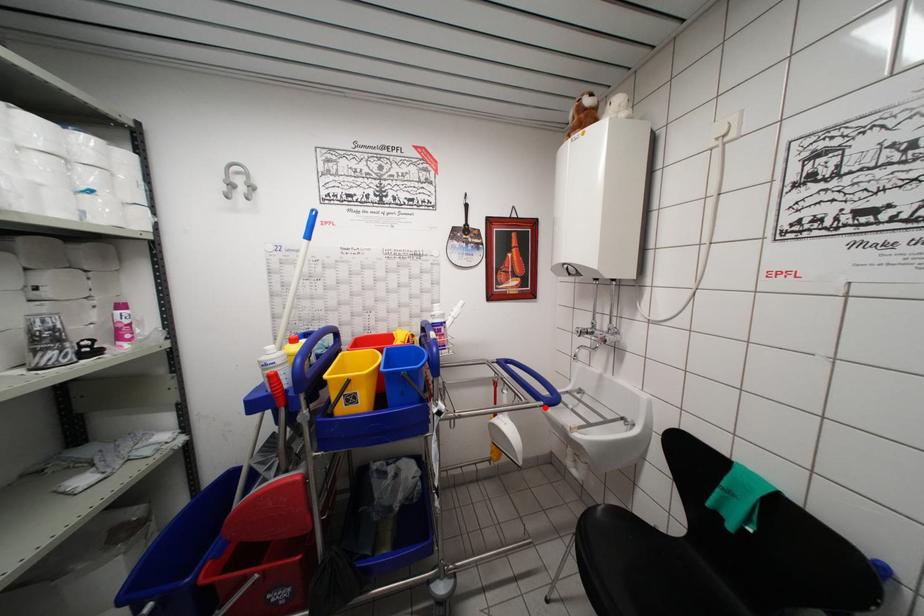
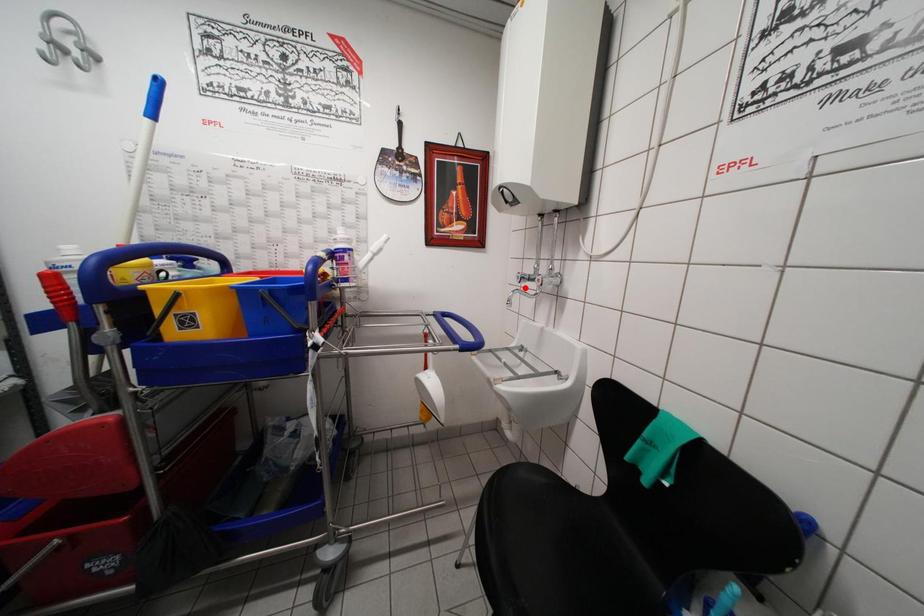
I am providing you with two images of the same scene from different viewpoints. A red point is marked on the first image and another point is marked on the second image. Are the points marked in image1 and image2 representing the same 3D position?

No